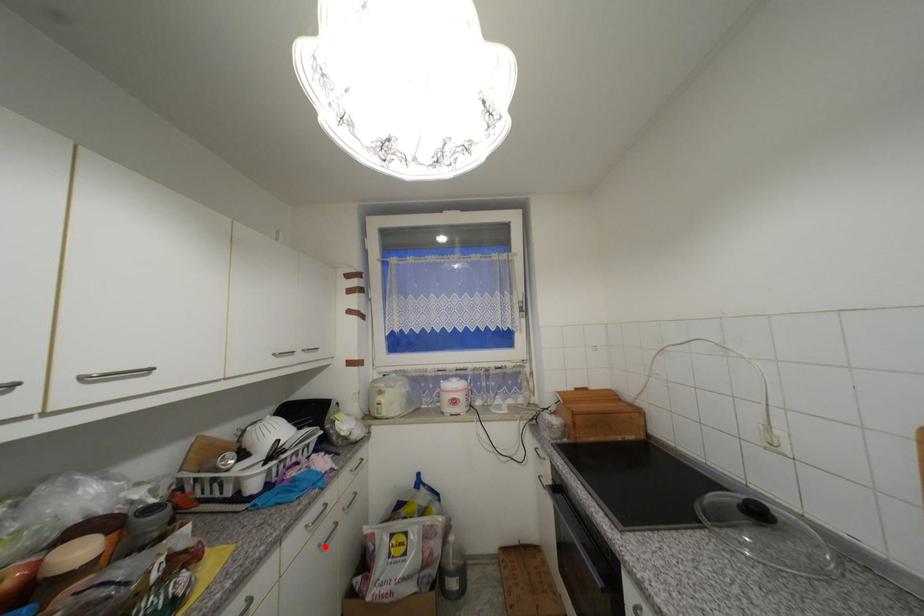
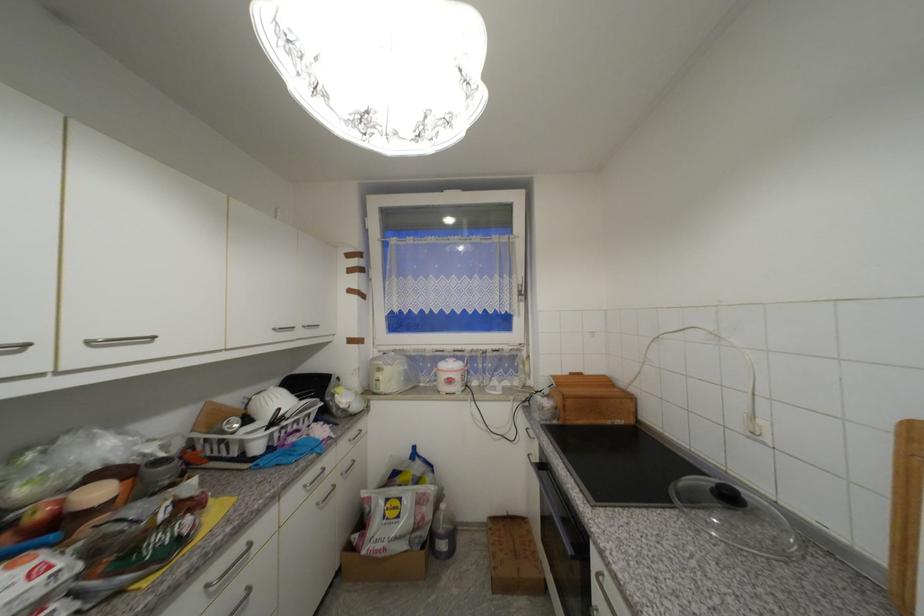
In the second image, find the point that corresponds to the highlighted location in the first image.

(322, 505)